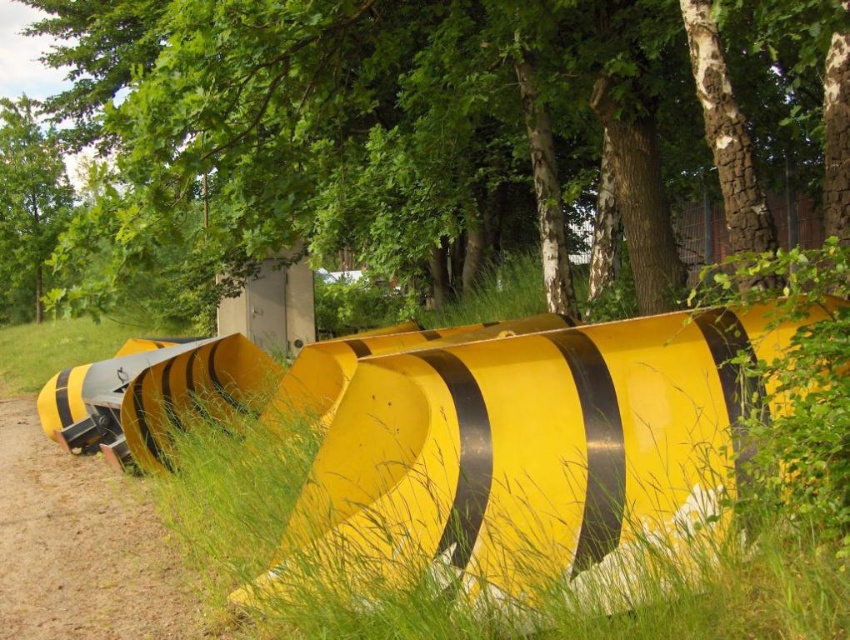
You are standing at the center of the image and want to walk towards the yellow matte dirt track at lower left and the green leafy tree at upper left. Which object will you reach first?

The yellow matte dirt track at lower left is closer to the viewer than the green leafy tree at upper left, so you will reach the yellow matte dirt track at lower left first.

You are a bird flying over the scene. You see the brown textured tree at upper center and the green leafy tree at upper left. Which tree is higher up in the image?

The brown textured tree at upper center is positioned over the green leafy tree at upper left, so it is higher up in the image.